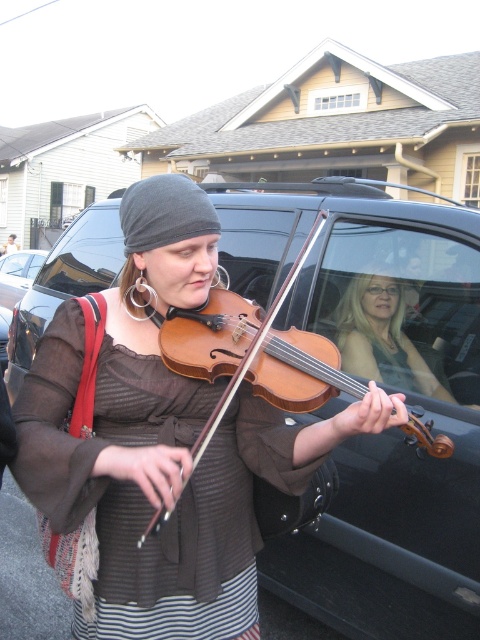
You are standing at the origin point of the coordinate system where the violinist is playing. The shiny black car at center is located at point (382, 387). If you want to walk directly towards the shiny black car at center from your current position, in which direction should you head?

The shiny black car at center is located at point (382, 387), so you should head northeast to reach it.

You are standing at the origin point of the coordinate system in the image. The woman playing the violin is at position 0.5, 0.5. Can you determine the direction of the shiny black car at center relative to the violinist?

The shiny black car at center is located at point [382,387], which is to the right and slightly below the violinist at [240,320].